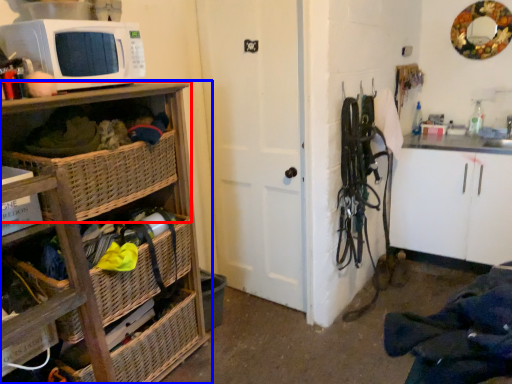
Question: Which object appears closest to the camera in this image, shelf (highlighted by a red box) or cabinetry (highlighted by a blue box)?

Choices:
 (A) shelf
 (B) cabinetry

Answer: (B)